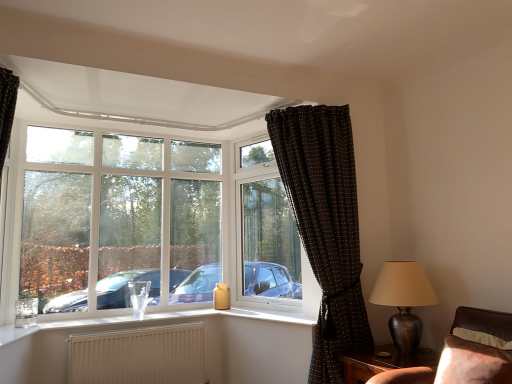
What are the coordinates of `empty space that is ontop of white textured radiator at lower center (from a real-world perspective)` in the screenshot? It's located at (131, 329).